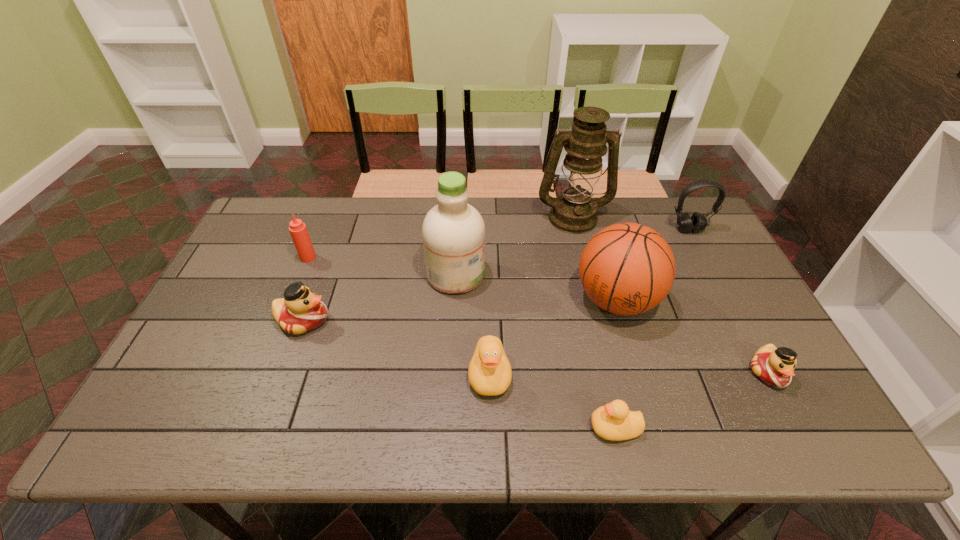
Find the location of `green oil lamp`. green oil lamp is located at coordinates (574, 211).

Where is `the eighth shortest object`? Image resolution: width=960 pixels, height=540 pixels. the eighth shortest object is located at coordinates (453, 231).

Identify the location of the third tallest object. This screenshot has width=960, height=540. (628, 268).

This screenshot has height=540, width=960. I want to click on basketball, so click(628, 268).

The width and height of the screenshot is (960, 540). Find the location of `headset`. headset is located at coordinates (697, 222).

Locate an element on the screen. The width and height of the screenshot is (960, 540). Tabasco sauce is located at coordinates (298, 230).

Where is `the bigger red duck`? This screenshot has width=960, height=540. the bigger red duck is located at coordinates (300, 311).

Where is `the leftmost duck`? This screenshot has height=540, width=960. the leftmost duck is located at coordinates (300, 311).

Find the location of a particular element. The image size is (960, 540). the farther yellow duck is located at coordinates (489, 372).

Where is `the bigger yellow duck`? This screenshot has width=960, height=540. the bigger yellow duck is located at coordinates (489, 372).